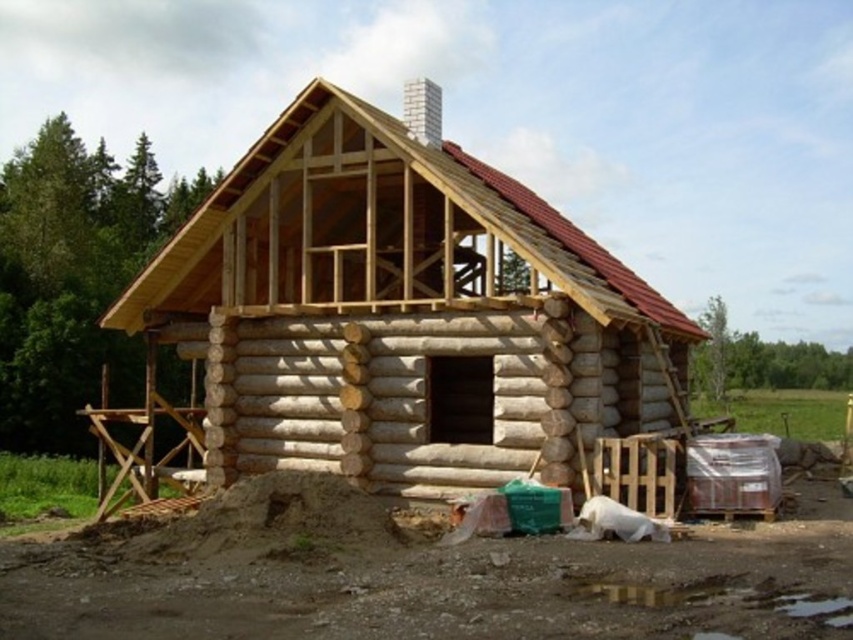
Question: Which of the following is the closest to the observer?

Choices:
 (A) brown dirt field at lower center
 (B) natural wood log cabin at center

Answer: (A)

Question: Where is natural wood log cabin at center located in relation to brown dirt field at lower center in the image?

Choices:
 (A) below
 (B) above

Answer: (B)

Question: Which of the following is the farthest from the observer?

Choices:
 (A) (300, 129)
 (B) (186, 516)

Answer: (A)

Question: Does natural wood log cabin at center come behind brown dirt field at lower center?

Choices:
 (A) no
 (B) yes

Answer: (B)

Question: Does natural wood log cabin at center have a smaller size compared to brown dirt field at lower center?

Choices:
 (A) yes
 (B) no

Answer: (B)

Question: Which point appears farthest from the camera in this image?

Choices:
 (A) (427, 404)
 (B) (55, 561)

Answer: (A)